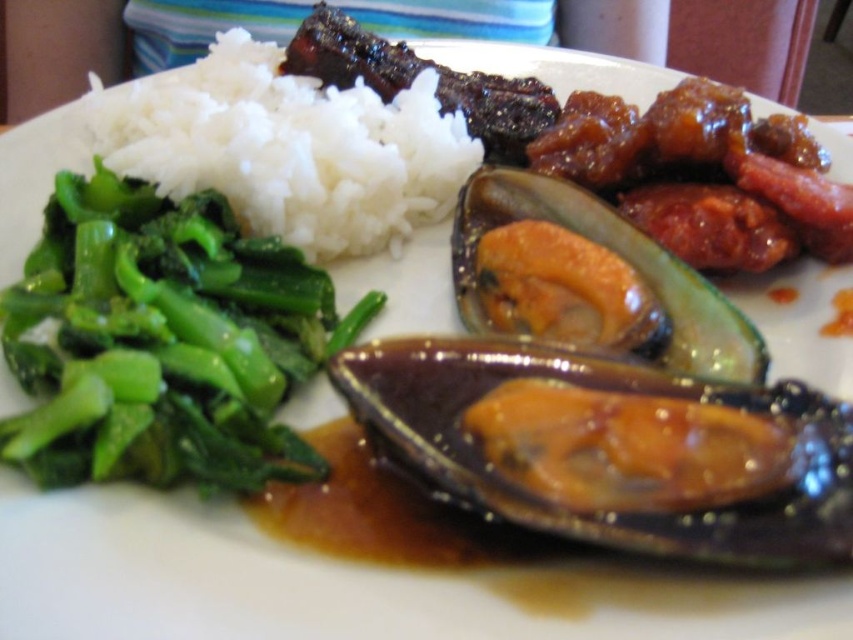
Is point (675, 392) closer to camera compared to point (9, 326)?

Yes, it is.

Who is more distant from viewer, (781, 540) or (134, 468)?

Point (134, 468)

Image resolution: width=853 pixels, height=640 pixels. I want to click on shiny brown oyster at center, so click(x=613, y=448).

Identify the location of shiny brown oyster at center. This screenshot has width=853, height=640. (613, 448).

Measure the distance between shiny brown oyster at center and white matte rice at upper left.

shiny brown oyster at center is 15.46 inches away from white matte rice at upper left.

Describe the element at coordinates (613, 448) in the screenshot. I see `shiny brown oyster at center` at that location.

What do you see at coordinates (613, 448) in the screenshot? This screenshot has width=853, height=640. I see `shiny brown oyster at center` at bounding box center [613, 448].

This screenshot has width=853, height=640. In order to click on shiny brown oyster at center in this screenshot , I will do `click(613, 448)`.

Which is more to the left, shiny brown oyster at center or shiny orange shell at center?

shiny brown oyster at center is more to the left.

Based on the photo, does shiny brown oyster at center have a greater height compared to shiny orange shell at center?

No, shiny brown oyster at center is not taller than shiny orange shell at center.

The width and height of the screenshot is (853, 640). Describe the element at coordinates (613, 448) in the screenshot. I see `shiny brown oyster at center` at that location.

Where is `shiny brown oyster at center`? The image size is (853, 640). shiny brown oyster at center is located at coordinates point(613,448).